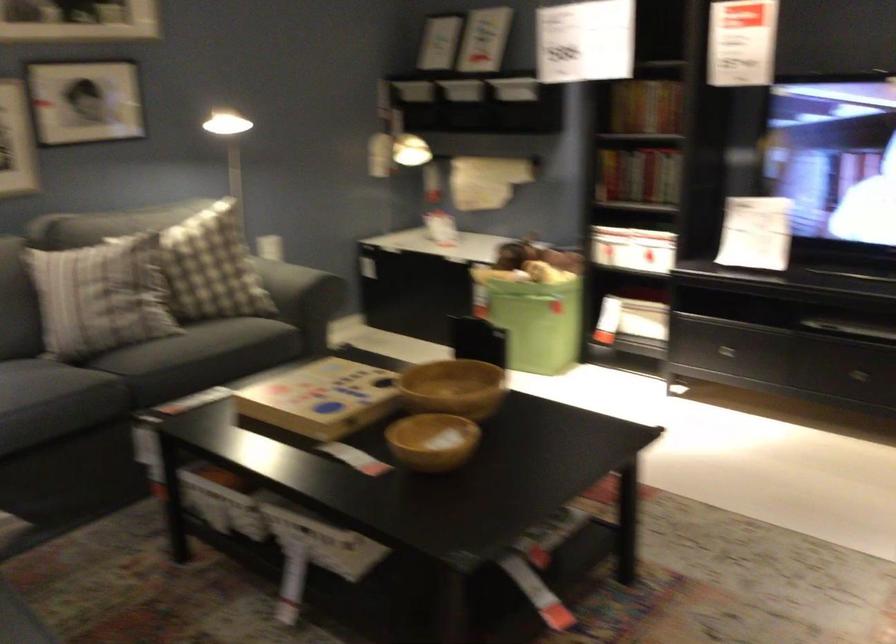
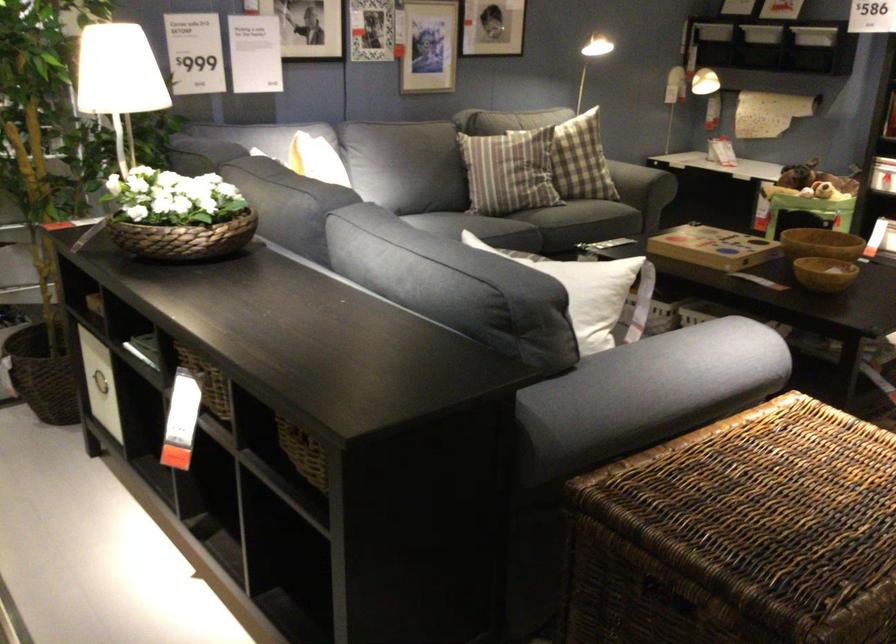
In the second image, find the point that corresponds to [234,292] in the first image.

(633, 180)